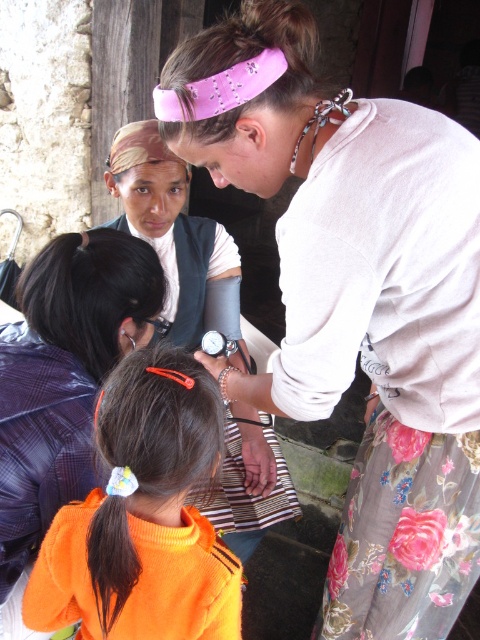
Question: Which object is positioned farthest from the orange fabric hair tie at center?

Choices:
 (A) orange fabric hair tie at lower left
 (B) orange fabric at center
 (C) pink fabric headband at upper center

Answer: (B)

Question: Is orange fabric hair tie at center thinner than orange fabric at center?

Choices:
 (A) no
 (B) yes

Answer: (B)

Question: Which object is farther from the camera taking this photo?

Choices:
 (A) orange fabric at center
 (B) orange fabric hair tie at center
 (C) orange fabric hair tie at lower left
 (D) pink fabric headband at upper center

Answer: (A)

Question: Can you confirm if orange fabric hair tie at center is thinner than orange fabric hair tie at lower left?

Choices:
 (A) yes
 (B) no

Answer: (B)

Question: Does orange fabric hair tie at lower left have a smaller size compared to orange fabric at center?

Choices:
 (A) no
 (B) yes

Answer: (B)

Question: Which point is closer to the camera?

Choices:
 (A) (193, 104)
 (B) (38, 360)
 (C) (106, 490)
 (D) (171, 216)

Answer: (A)